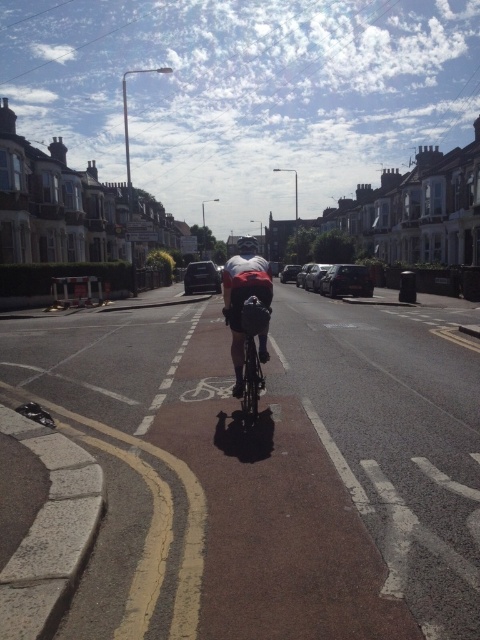
Question: Does white fabric cyclist at center appear on the left side of matte black helmet at center?

Choices:
 (A) no
 (B) yes

Answer: (A)

Question: Which point is closer to the camera?

Choices:
 (A) (252, 252)
 (B) (250, 348)

Answer: (B)

Question: Which point appears farthest from the camera in this image?

Choices:
 (A) pos(247,378)
 (B) pos(197,348)
 (C) pos(238,252)
 (D) pos(227,300)

Answer: (B)

Question: Is brown asphalt bike lane at center in front of white fabric cyclist at center?

Choices:
 (A) yes
 (B) no

Answer: (A)

Question: Can you confirm if brown asphalt bike lane at center is thinner than white fabric cyclist at center?

Choices:
 (A) yes
 (B) no

Answer: (B)

Question: Which point is closer to the camera taking this photo?

Choices:
 (A) (251, 305)
 (B) (252, 237)
 (C) (443, 314)

Answer: (A)